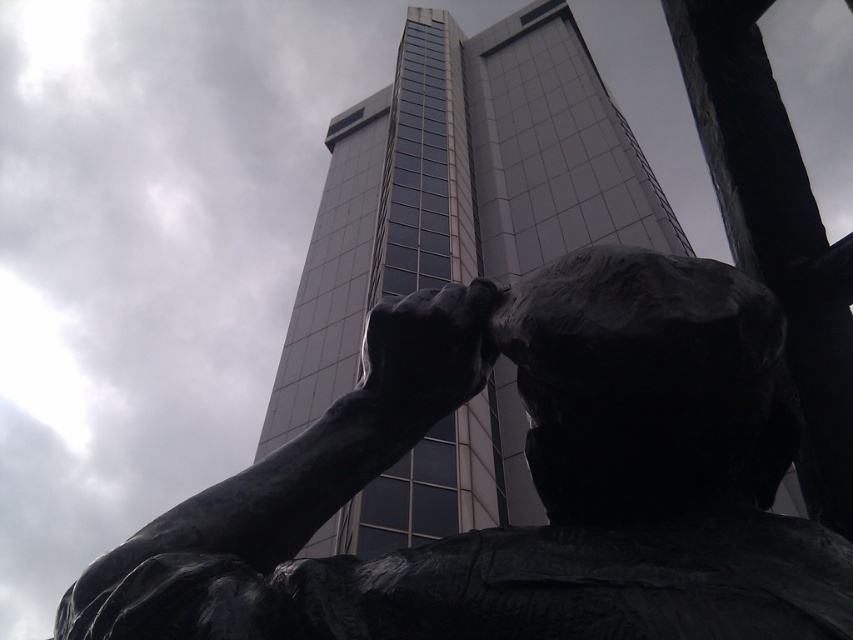
How far apart are black polished statue at center and smooth glass tower at center?

The distance of black polished statue at center from smooth glass tower at center is 39.54 feet.

Is black polished statue at center further to the viewer compared to smooth glass tower at center?

No.

Locate an element on the screen. black polished statue at center is located at coordinates (532, 477).